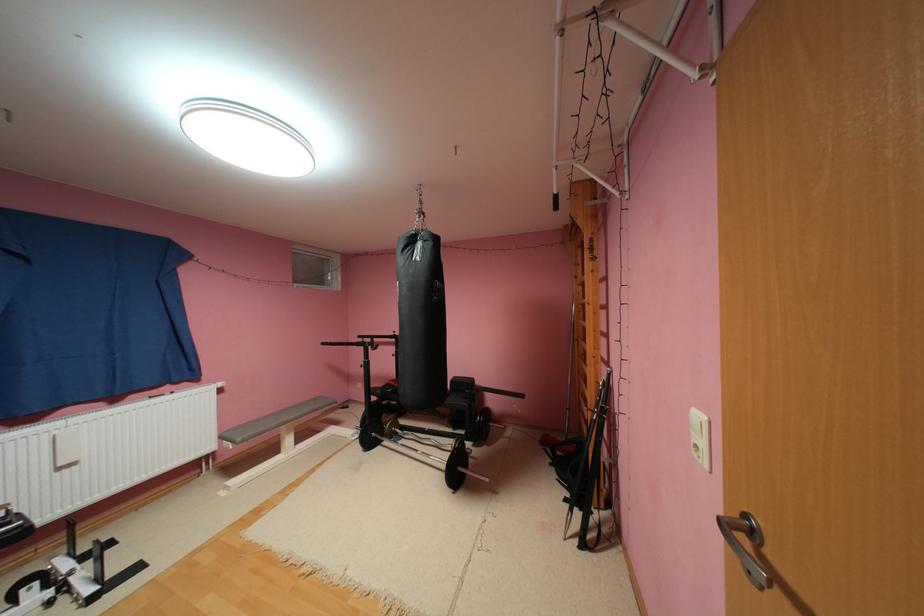
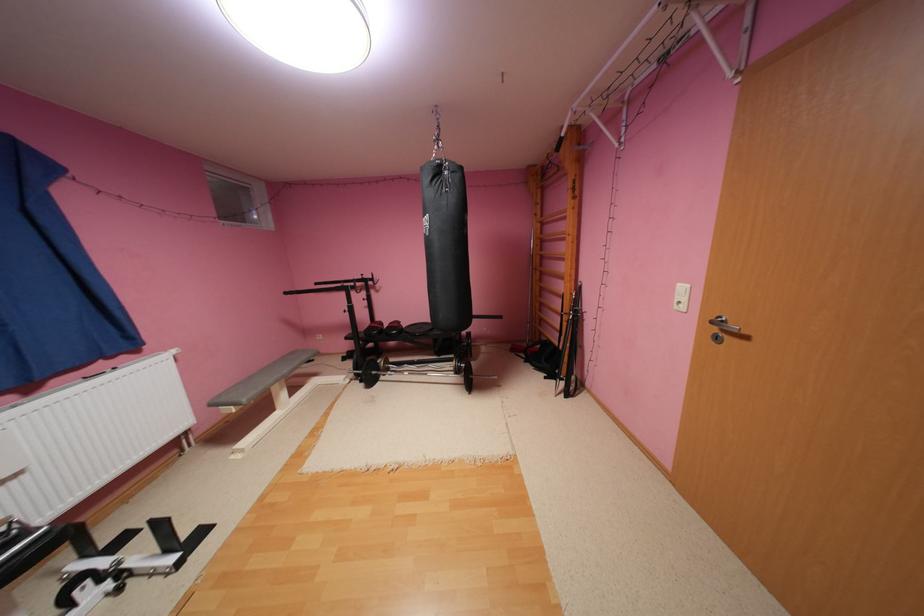
Question: In a continuous first-person perspective shot, in which direction is the camera moving?

Choices:
 (A) Left
 (B) Right
 (C) Forward
 (D) Backward

Answer: (A)